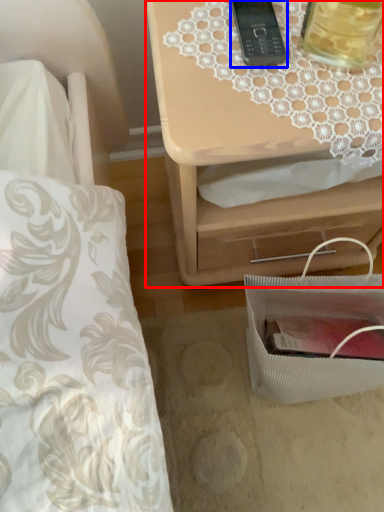
Question: Among these objects, which one is farthest to the camera, nightstand (highlighted by a red box) or gadget (highlighted by a blue box)?

Choices:
 (A) nightstand
 (B) gadget

Answer: (B)